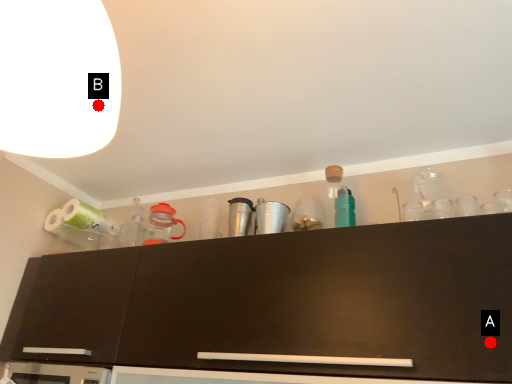
Question: Two points are circled on the image, labeled by A and B beside each circle. Which point is farther from the camera taking this photo?

Choices:
 (A) A is further
 (B) B is further

Answer: (A)